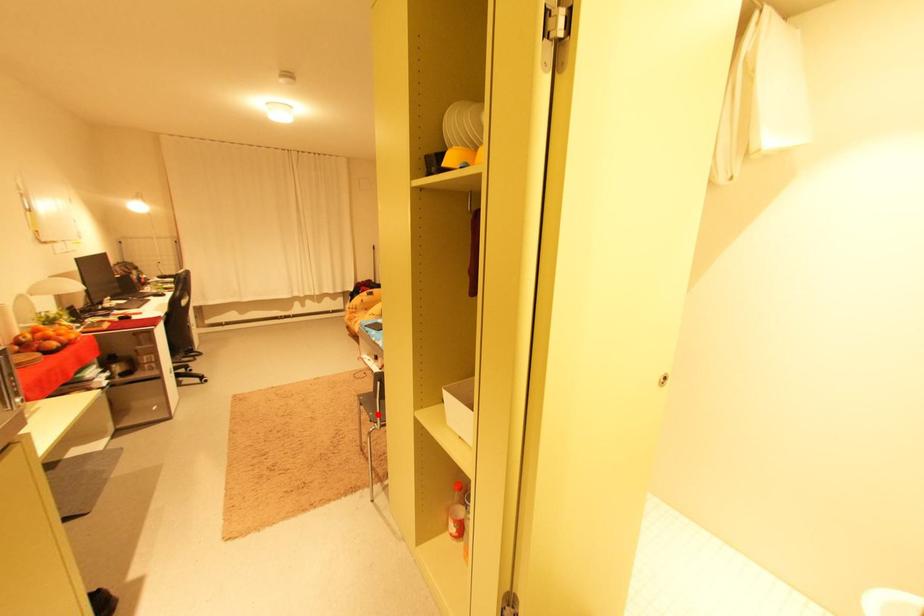
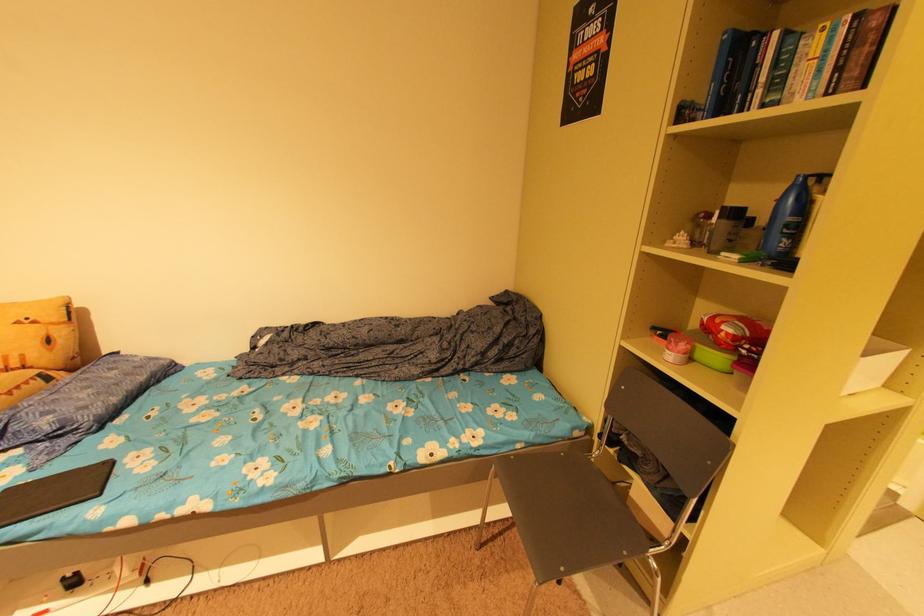
Question: I am providing you with two images of the same scene from different viewpoints. In image1, a red point is highlighted. Considering the same 3D point in image2, which of the following is correct?

Choices:
 (A) It is closer
 (B) It is farther

Answer: (A)